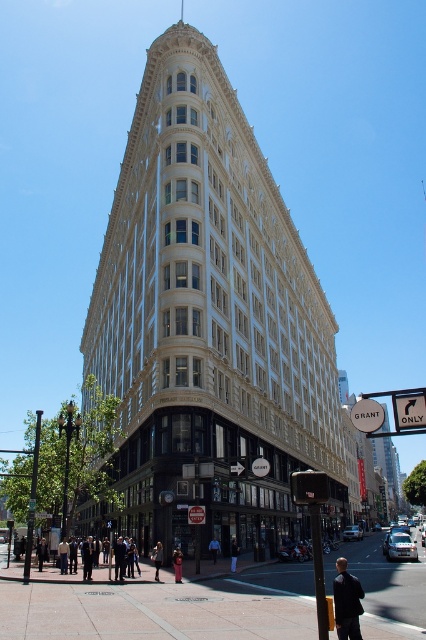
You are a pedestrian standing on the concrete sidewalk at lower center. You want to enter the white stone building at center. Is the sidewalk in front of or behind the building?

The concrete sidewalk at lower center is behind the white stone building at center, so it is behind the building.

What is the 2D coordinate of the white stone building at center?

The white stone building at center is located at the 2D coordinate point of (210, 324).